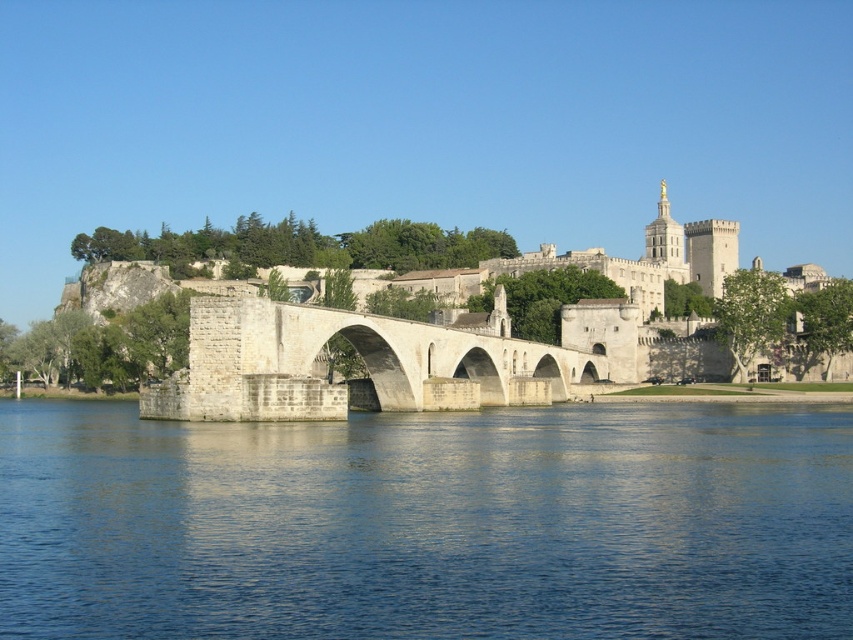
Question: Which object appears closest to the camera in this image?

Choices:
 (A) white stone bridge at center
 (B) blue water at center

Answer: (B)

Question: From the image, what is the correct spatial relationship of blue water at center in relation to white stone castle at center?

Choices:
 (A) left
 (B) right

Answer: (B)

Question: Which point appears farthest from the camera in this image?

Choices:
 (A) (33, 628)
 (B) (631, 324)
 (C) (544, 400)

Answer: (B)

Question: Can you confirm if blue water at center is positioned to the left of white stone bridge at center?

Choices:
 (A) no
 (B) yes

Answer: (A)

Question: Is blue water at center to the right of white stone bridge at center from the viewer's perspective?

Choices:
 (A) no
 (B) yes

Answer: (B)

Question: Estimate the real-world distances between objects in this image. Which object is closer to the blue water at center?

Choices:
 (A) white stone castle at center
 (B) white stone bridge at center

Answer: (B)